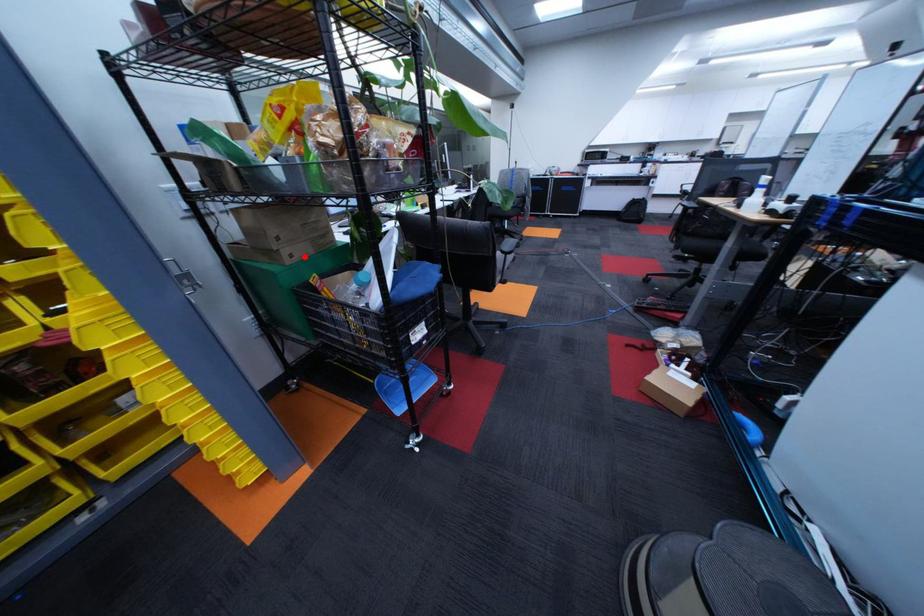
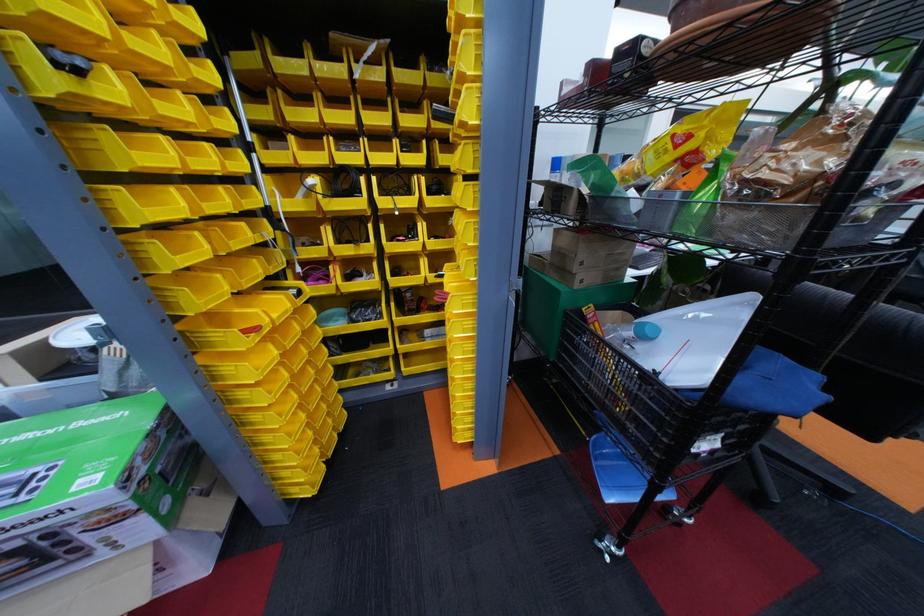
Question: I am providing you with two images of the same scene from different viewpoints. A red point is marked on the first image. Is the red point's position out of view in image 2?

Choices:
 (A) Yes
 (B) No

Answer: (B)